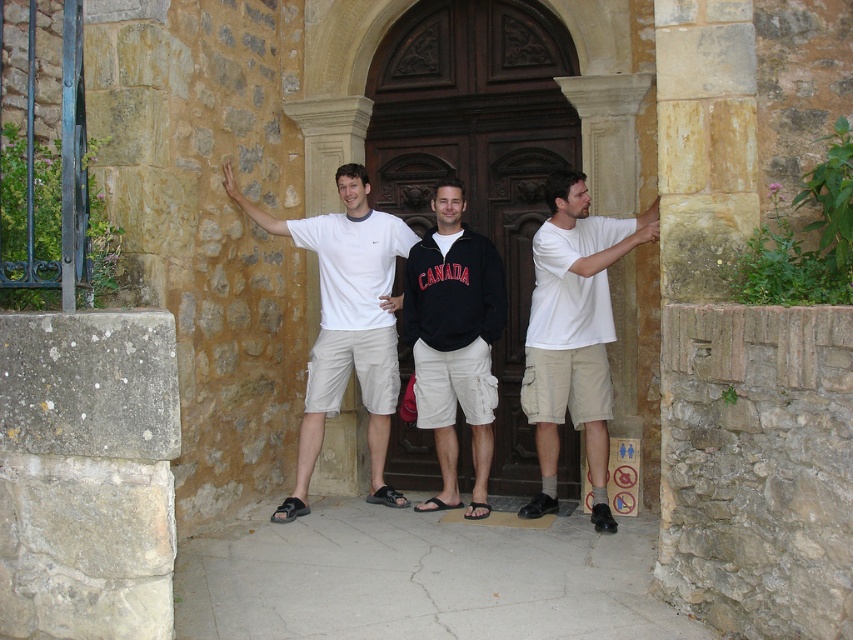
Describe the element at coordinates (479, 156) in the screenshot. This screenshot has height=640, width=853. I see `dark wood door at center` at that location.

Is point (514, 416) positioned in front of point (593, 246)?

No, (514, 416) is behind (593, 246).

Identify the location of dark wood door at center. (479, 156).

Locate an element on the screen. The height and width of the screenshot is (640, 853). dark wood door at center is located at coordinates (479, 156).

Is point (581, 212) less distant than point (477, 422)?

Yes, it is in front of point (477, 422).

Between white cotton t-shirt at right and black cotton sweatshirt at center, which one appears on the right side from the viewer's perspective?

white cotton t-shirt at right is more to the right.

Is point (605, 392) positioned behind point (413, 278)?

No, it is in front of (413, 278).

The image size is (853, 640). I want to click on white cotton t-shirt at right, so 573,332.

Is point (590, 470) behind point (368, 422)?

No.

Image resolution: width=853 pixels, height=640 pixels. What do you see at coordinates (573, 332) in the screenshot?
I see `white cotton t-shirt at right` at bounding box center [573, 332].

The height and width of the screenshot is (640, 853). What are the coordinates of `white cotton t-shirt at right` in the screenshot? It's located at (573, 332).